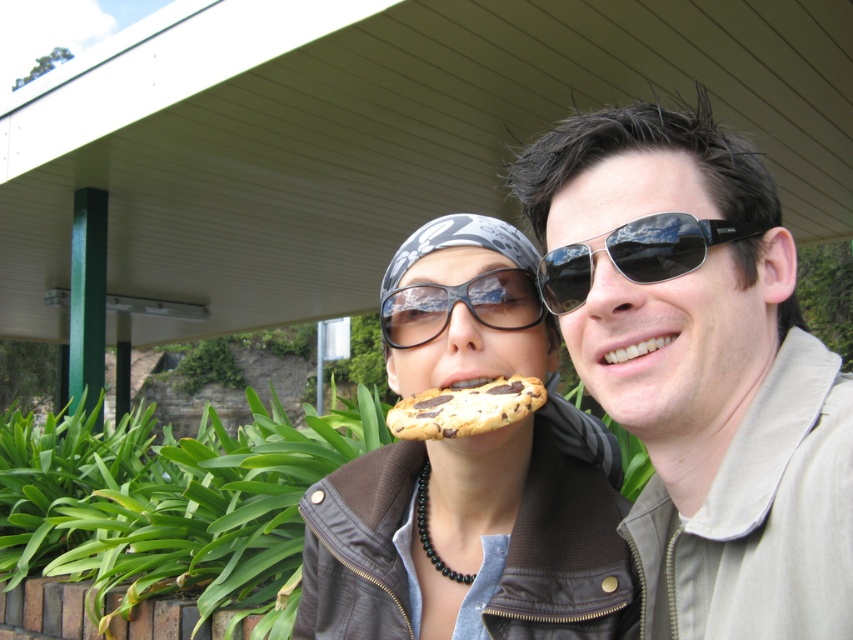
Question: Is brown leather jacket at center below sunglasses at center?

Choices:
 (A) no
 (B) yes

Answer: (B)

Question: Does brown leather jacket at center have a larger size compared to sunglasses at center?

Choices:
 (A) no
 (B) yes

Answer: (B)

Question: Among these objects, which one is nearest to the camera?

Choices:
 (A) matte brown jacket at center
 (B) chocolate chip cookie at center

Answer: (A)

Question: Among these objects, which one is nearest to the camera?

Choices:
 (A) chocolate chip cookie at center
 (B) sunglasses at center
 (C) brown leather jacket at center
 (D) transparent plastic goggles at center

Answer: (B)

Question: Which object appears closest to the camera in this image?

Choices:
 (A) matte brown jacket at center
 (B) brown leather jacket at center

Answer: (A)

Question: From the image, what is the correct spatial relationship of matte brown jacket at center in relation to brown leather jacket at center?

Choices:
 (A) left
 (B) right

Answer: (B)